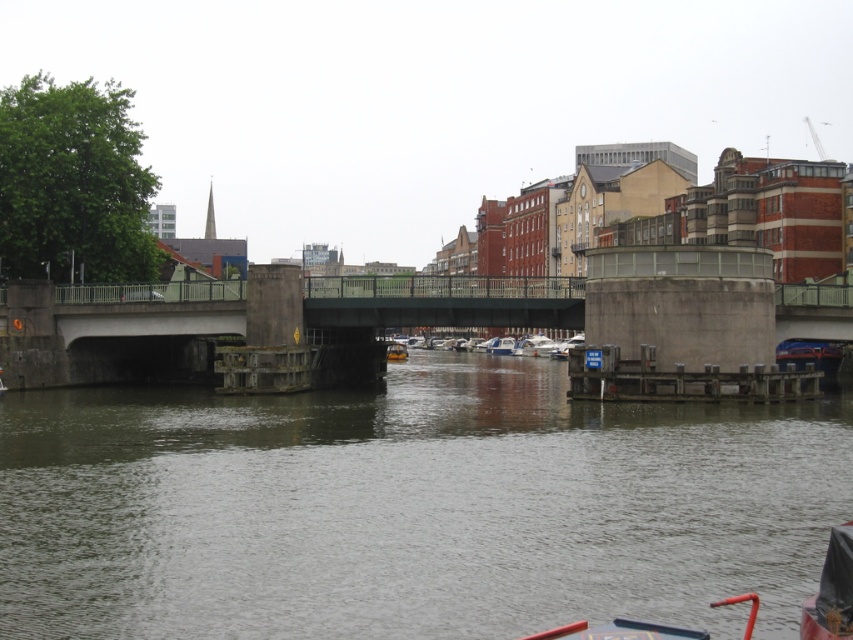
Question: Among these objects, which one is nearest to the camera?

Choices:
 (A) white plastic boat at center
 (B) white plastic boats at center

Answer: (B)

Question: Does smooth concrete water at center appear under white plastic boats at center?

Choices:
 (A) yes
 (B) no

Answer: (A)

Question: Which point is farther from the camera taking this photo?

Choices:
 (A) (531, 349)
 (B) (749, 497)

Answer: (A)

Question: Does smooth concrete water at center have a lesser width compared to yellow rubber boat at center?

Choices:
 (A) yes
 (B) no

Answer: (B)

Question: Is the position of smooth concrete water at center more distant than that of white plastic boats at center?

Choices:
 (A) no
 (B) yes

Answer: (A)

Question: Which point is farther from the camera taking this photo?

Choices:
 (A) (498, 348)
 (B) (534, 378)
 (C) (386, 355)
 (D) (469, 349)

Answer: (D)